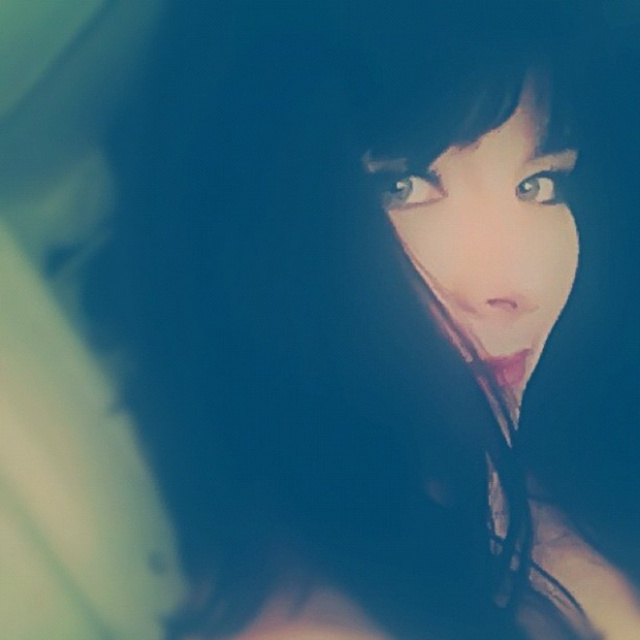
Question: From the image, what is the correct spatial relationship of smooth skin face at center in relation to smooth black hair at upper center?

Choices:
 (A) right
 (B) left

Answer: (A)

Question: Can you confirm if smooth skin face at center is positioned below smooth black hair at upper center?

Choices:
 (A) yes
 (B) no

Answer: (A)

Question: Among these objects, which one is nearest to the camera?

Choices:
 (A) smooth black hair at upper center
 (B) smooth skin face at center

Answer: (A)

Question: Among these points, which one is nearest to the camera?

Choices:
 (A) coord(481,241)
 (B) coord(378,156)

Answer: (B)

Question: Does smooth skin face at center have a larger size compared to smooth black hair at upper center?

Choices:
 (A) no
 (B) yes

Answer: (B)